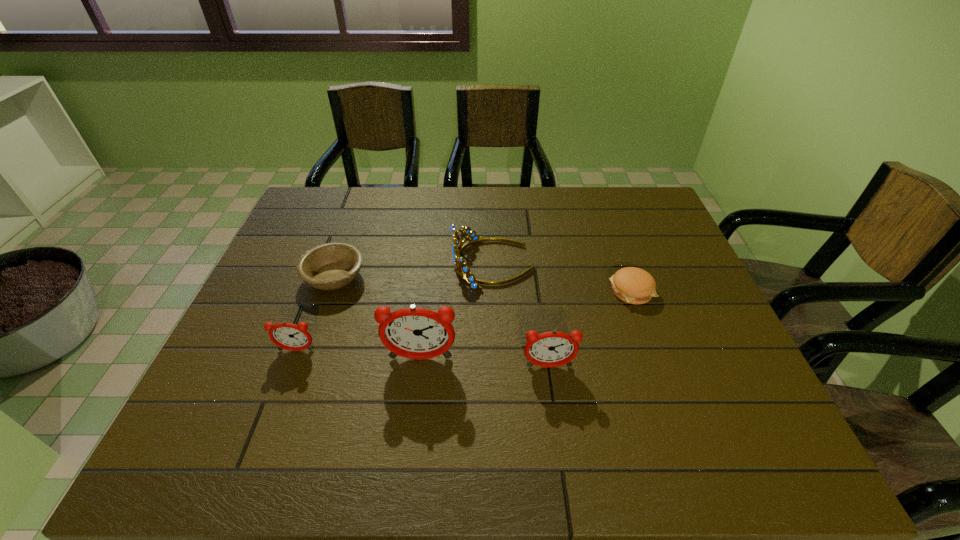
Please point a spot on the right to add another alarm clock. Please provide its 2D coordinates. Your answer should be formatted as a tuple, i.e. [(x, y)], where the tuple contains the x and y coordinates of a point satisfying the conditions above.

[(682, 375)]